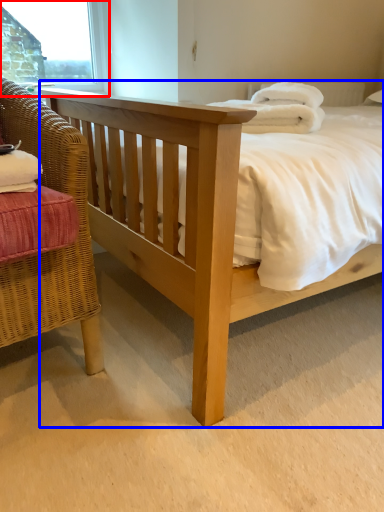
Question: Which object appears closest to the camera in this image, window frame (highlighted by a red box) or bed (highlighted by a blue box)?

Choices:
 (A) window frame
 (B) bed

Answer: (B)